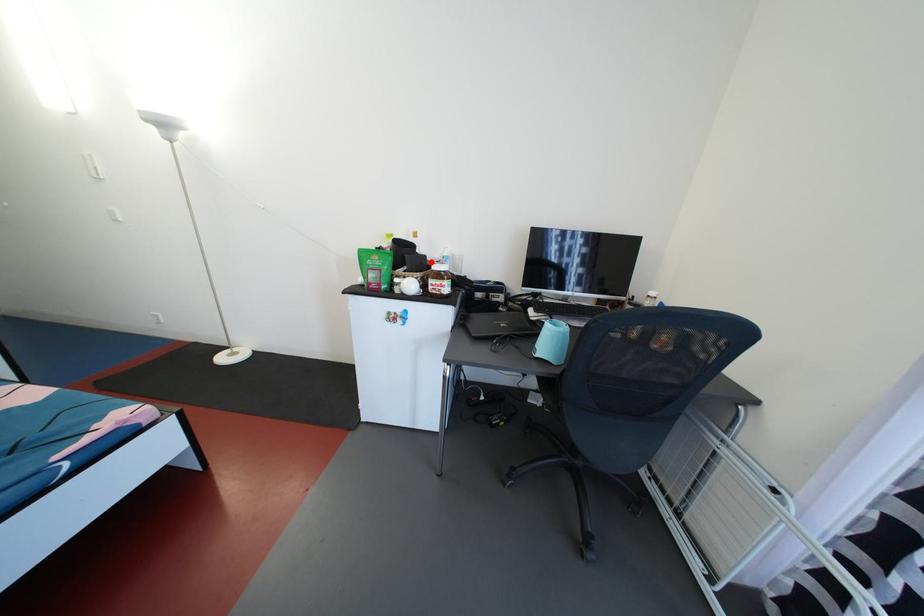
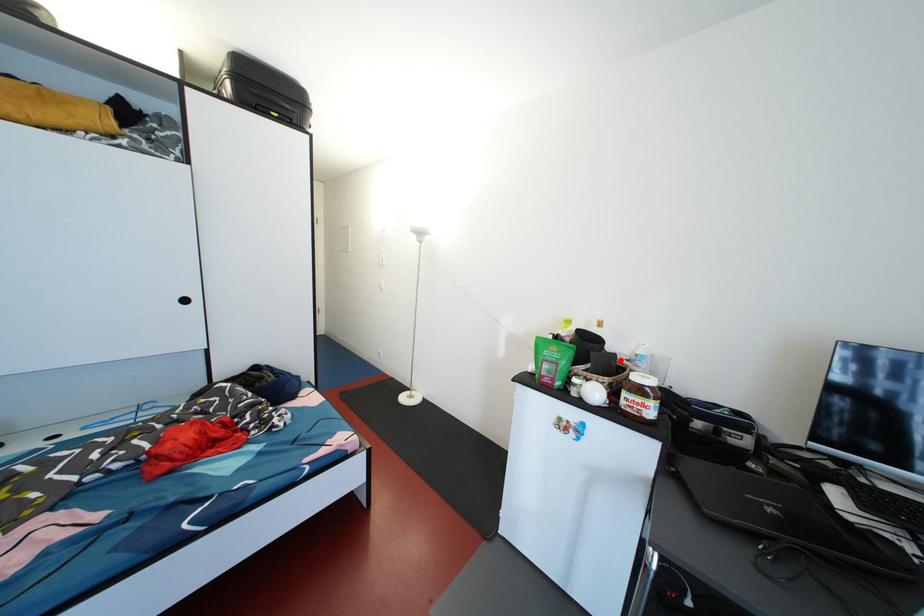
I am providing you with two images of the same scene from different viewpoints. A red point is marked on the first image and another point is marked on the second image. Does the point marked in image1 correspond to the same location as the one in image2?

Yes